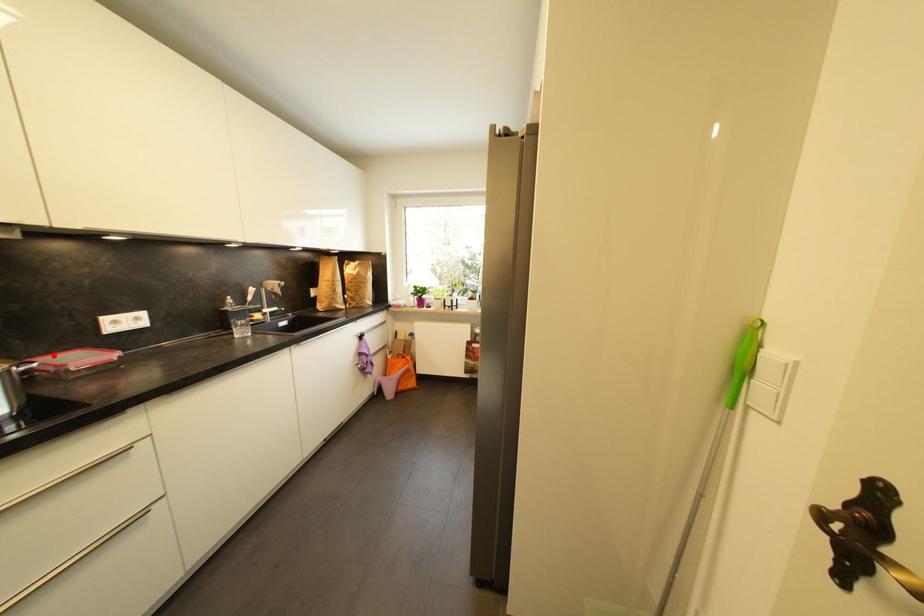
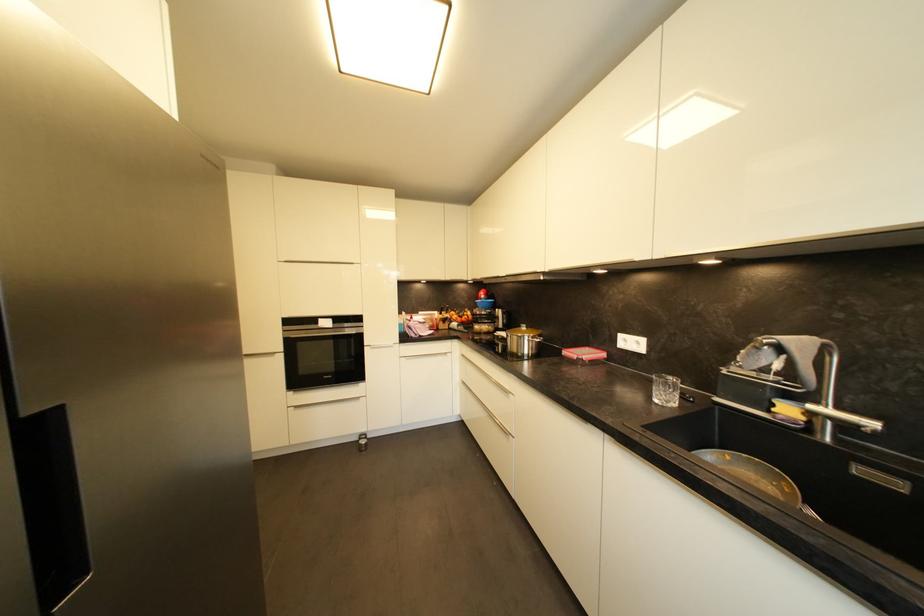
Question: I am providing you with two images of the same scene from different viewpoints. A red point is shown in image1. For the corresponding object point in image2, is it positioned nearer or farther from the camera?

Choices:
 (A) Nearer
 (B) Farther

Answer: (A)